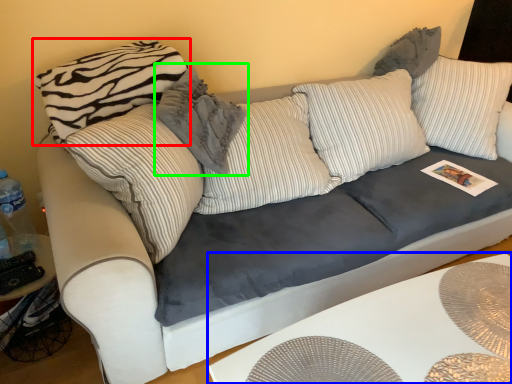
Question: Considering the real-world distances, which object is closest to pillow (highlighted by a red box)? table (highlighted by a blue box) or pillow (highlighted by a green box).

Choices:
 (A) table
 (B) pillow

Answer: (B)